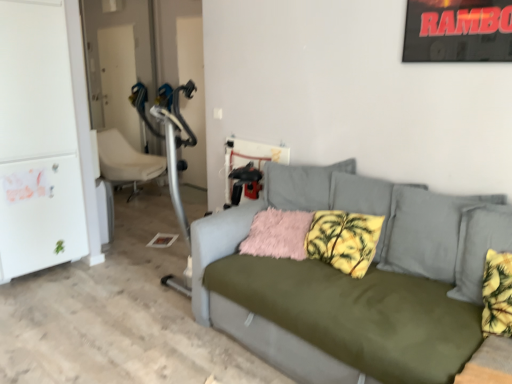
Describe the element at coordinates (38, 138) in the screenshot. Image resolution: width=512 pixels, height=384 pixels. I see `white matte refrigerator at left` at that location.

The height and width of the screenshot is (384, 512). Describe the element at coordinates (278, 234) in the screenshot. I see `fuzzy pink pillow at center, the second pillow when ordered from right to left` at that location.

Measure the distance between point (269,209) and camera.

Point (269,209) and camera are 8.93 feet apart from each other.

How much space does yellow palm-patterned pillow at center, arranged as the first pillow when viewed from the right, occupy vertically?

yellow palm-patterned pillow at center, arranged as the first pillow when viewed from the right, is 11.01 inches tall.

Image resolution: width=512 pixels, height=384 pixels. Identify the location of white matte refrigerator at left. (38, 138).

Is white plastic chair at left in front of or behind fuzzy pink pillow at center, the second pillow when ordered from right to left, in the image?

white plastic chair at left is positioned farther from the viewer than fuzzy pink pillow at center, the second pillow when ordered from right to left.

Does white plastic chair at left have a greater width compared to fuzzy pink pillow at center, the second pillow when ordered from right to left?

Correct, the width of white plastic chair at left exceeds that of fuzzy pink pillow at center, the second pillow when ordered from right to left.

Is white plastic chair at left aimed at fuzzy pink pillow at center, which is the 1th pillow in left-to-right order?

Yes, white plastic chair at left is facing fuzzy pink pillow at center, which is the 1th pillow in left-to-right order.

Is white plastic chair at left bigger than fuzzy pink pillow at center, the second pillow when ordered from right to left?

Yes.

Which is in front, white matte refrigerator at left or olive green fabric couch at center?

olive green fabric couch at center is more forward.

From a real-world perspective, between white matte refrigerator at left and olive green fabric couch at center, who is vertically higher?

In real-world perspective, white matte refrigerator at left is above.

Is point (74, 173) closer or farther from the camera than point (398, 241)?

Point (74, 173) is farther from the camera than point (398, 241).

Considering the relative sizes of white matte refrigerator at left and olive green fabric couch at center in the image provided, is white matte refrigerator at left taller than olive green fabric couch at center?

Indeed, white matte refrigerator at left has a greater height compared to olive green fabric couch at center.

From the picture: Does white plastic chair at left appear on the left side of yellow palm-patterned pillow at center, the 2th pillow from the left?

Indeed, white plastic chair at left is positioned on the left side of yellow palm-patterned pillow at center, the 2th pillow from the left.

From the image's perspective, between white plastic chair at left and yellow palm-patterned pillow at center, the 2th pillow from the left, who is located below?

From the image's view, yellow palm-patterned pillow at center, the 2th pillow from the left, is below.

Considering the points (137, 178) and (343, 222), which point is behind, point (137, 178) or point (343, 222)?

The point (137, 178) is behind.

Which object is more forward, olive green fabric couch at center or white plastic chair at left?

Positioned in front is olive green fabric couch at center.

Is olive green fabric couch at center facing towards white plastic chair at left?

No, olive green fabric couch at center is not aimed at white plastic chair at left.

Is point (398, 225) positioned behind point (134, 190)?

No, it is in front of (134, 190).

From the image's perspective, which one is positioned higher, olive green fabric couch at center or white plastic chair at left?

white plastic chair at left appears higher in the image.

This screenshot has width=512, height=384. I want to click on fridge above the white plastic chair at left (from the image's perspective), so click(x=38, y=138).

Looking at this image, is white matte refrigerator at left facing towards white plastic chair at left?

No, white matte refrigerator at left is not facing towards white plastic chair at left.

Can you confirm if white matte refrigerator at left is taller than white plastic chair at left?

Yes, white matte refrigerator at left is taller than white plastic chair at left.

In the scene shown: Is white matte refrigerator at left to the right of white plastic chair at left from the viewer's perspective?

In fact, white matte refrigerator at left is to the left of white plastic chair at left.

From a real-world perspective, which object rests below the other?

fuzzy pink pillow at center, the second pillow when ordered from right to left.

Considering the sizes of objects yellow palm-patterned pillow at center, the 2th pillow from the left, and fuzzy pink pillow at center, the second pillow when ordered from right to left, in the image provided, who is bigger, yellow palm-patterned pillow at center, the 2th pillow from the left, or fuzzy pink pillow at center, the second pillow when ordered from right to left,?

With larger size is yellow palm-patterned pillow at center, the 2th pillow from the left.

Is yellow palm-patterned pillow at center, the 2th pillow from the left, with fuzzy pink pillow at center, which is the 1th pillow in left-to-right order?

No, yellow palm-patterned pillow at center, the 2th pillow from the left, is not making contact with fuzzy pink pillow at center, which is the 1th pillow in left-to-right order.

Does yellow palm-patterned pillow at center, the 2th pillow from the left, have a lesser height compared to fuzzy pink pillow at center, which is the 1th pillow in left-to-right order?

In fact, yellow palm-patterned pillow at center, the 2th pillow from the left, may be taller than fuzzy pink pillow at center, which is the 1th pillow in left-to-right order.

Where is `pillow located below the fuzzy pink pillow at center, the second pillow when ordered from right to left (from the image's perspective)`? pillow located below the fuzzy pink pillow at center, the second pillow when ordered from right to left (from the image's perspective) is located at coordinates (344, 240).

Is fuzzy pink pillow at center, which is the 1th pillow in left-to-right order, aimed at yellow palm-patterned pillow at center, arranged as the first pillow when viewed from the right?

No, fuzzy pink pillow at center, which is the 1th pillow in left-to-right order, is not aimed at yellow palm-patterned pillow at center, arranged as the first pillow when viewed from the right.

Are fuzzy pink pillow at center, the second pillow when ordered from right to left, and yellow palm-patterned pillow at center, arranged as the first pillow when viewed from the right, located far from each other?

fuzzy pink pillow at center, the second pillow when ordered from right to left, is actually quite close to yellow palm-patterned pillow at center, arranged as the first pillow when viewed from the right.

Can you tell me how much fuzzy pink pillow at center, which is the 1th pillow in left-to-right order, and yellow palm-patterned pillow at center, the 2th pillow from the left, differ in facing direction?

They differ by 13.9 degrees in their facing directions.

Locate an element on the screen. the 1st pillow in front of the white plastic chair at left, counting from the anchor's position is located at coordinates (278, 234).

Find the location of a particular element. Image resolution: width=512 pixels, height=384 pixels. studio couch located on the right of white matte refrigerator at left is located at coordinates (346, 284).

Which object lies further to the anchor point yellow palm-patterned pillow at center, the 2th pillow from the left, olive green fabric couch at center or white plastic chair at left?

Among the two, white plastic chair at left is located further to yellow palm-patterned pillow at center, the 2th pillow from the left.

Estimate the real-world distances between objects in this image. Which object is further from olive green fabric couch at center, white plastic chair at left or white matte refrigerator at left?

Based on the image, white plastic chair at left appears to be further to olive green fabric couch at center.

Estimate the real-world distances between objects in this image. Which object is further from fuzzy pink pillow at center, the second pillow when ordered from right to left, olive green fabric couch at center or white plastic chair at left?

white plastic chair at left is positioned further to the anchor fuzzy pink pillow at center, the second pillow when ordered from right to left.

Based on their spatial positions, is olive green fabric couch at center or yellow palm-patterned pillow at center, the 2th pillow from the left, further from fuzzy pink pillow at center, which is the 1th pillow in left-to-right order?

Among the two, olive green fabric couch at center is located further to fuzzy pink pillow at center, which is the 1th pillow in left-to-right order.

Based on their spatial positions, is yellow palm-patterned pillow at center, arranged as the first pillow when viewed from the right, or white plastic chair at left closer to fuzzy pink pillow at center, the second pillow when ordered from right to left?

yellow palm-patterned pillow at center, arranged as the first pillow when viewed from the right, is closer to fuzzy pink pillow at center, the second pillow when ordered from right to left.

Based on their spatial positions, is white plastic chair at left or fuzzy pink pillow at center, the second pillow when ordered from right to left, closer to white matte refrigerator at left?

The object closer to white matte refrigerator at left is white plastic chair at left.

Considering their positions, is olive green fabric couch at center positioned closer to white plastic chair at left than yellow palm-patterned pillow at center, arranged as the first pillow when viewed from the right?

olive green fabric couch at center is positioned closer to the anchor white plastic chair at left.

Based on their spatial positions, is white plastic chair at left or yellow palm-patterned pillow at center, arranged as the first pillow when viewed from the right, further from white matte refrigerator at left?

yellow palm-patterned pillow at center, arranged as the first pillow when viewed from the right, lies further to white matte refrigerator at left than the other object.

Locate an element on the screen. This screenshot has width=512, height=384. pillow located between white matte refrigerator at left and olive green fabric couch at center in the left-right direction is located at coordinates (278, 234).

Locate an element on the screen. This screenshot has width=512, height=384. fridge positioned between fuzzy pink pillow at center, which is the 1th pillow in left-to-right order, and white plastic chair at left from near to far is located at coordinates (38, 138).

I want to click on pillow between olive green fabric couch at center and fuzzy pink pillow at center, the second pillow when ordered from right to left, in the front-back direction, so [x=344, y=240].

Locate an element on the screen. The image size is (512, 384). studio couch between white matte refrigerator at left and yellow palm-patterned pillow at center, arranged as the first pillow when viewed from the right is located at coordinates click(x=346, y=284).